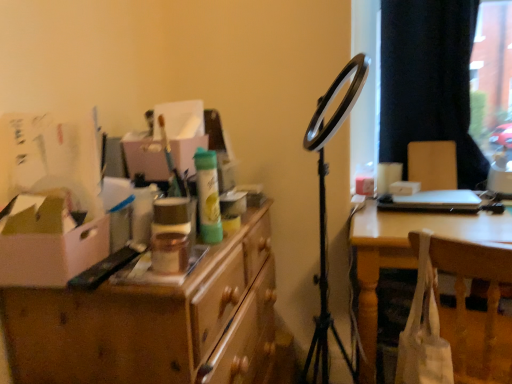
The height and width of the screenshot is (384, 512). Identify the location of vacant area on top of white cardboard box at left (from a real-world perspective). (47, 223).